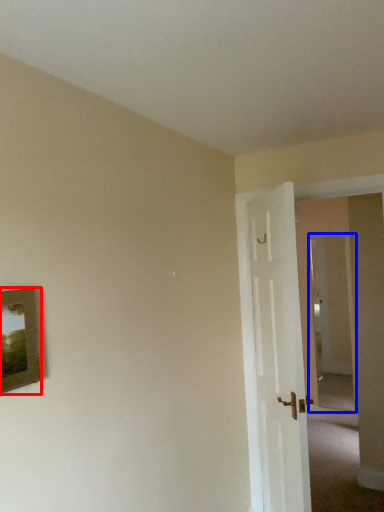
Question: Which object appears closest to the camera in this image, picture frame (highlighted by a red box) or glass door (highlighted by a blue box)?

Choices:
 (A) picture frame
 (B) glass door

Answer: (A)